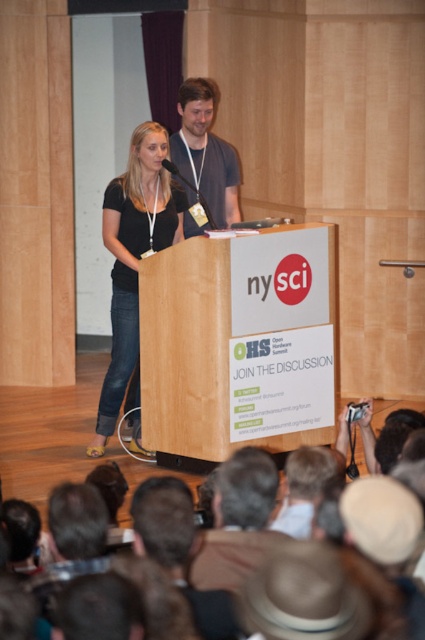
Between point (121, 381) and point (212, 196), which one is positioned behind?

The point (212, 196) is behind.

Based on the photo, can you confirm if matte black shirt at center is positioned to the left of dark gray shirt at center?

Indeed, matte black shirt at center is positioned on the left side of dark gray shirt at center.

Does point (130, 198) come behind point (215, 195)?

No, (130, 198) is in front of (215, 195).

You are a GUI agent. You are given a task and a screenshot of the screen. Output one action in this format:
    pyautogui.click(x=<x>, y=<y>)
    Task: Click on the matte black shirt at center
    
    Given the screenshot: What is the action you would take?
    pyautogui.click(x=133, y=256)

Is dark brown leather jacket at lower center to the left of dark gray shirt at center from the viewer's perspective?

In fact, dark brown leather jacket at lower center is to the right of dark gray shirt at center.

Is dark brown leather jacket at lower center positioned at the back of dark gray shirt at center?

That is False.

The image size is (425, 640). Describe the element at coordinates (238, 522) in the screenshot. I see `dark brown leather jacket at lower center` at that location.

Locate an element on the screen. This screenshot has width=425, height=640. dark brown leather jacket at lower center is located at coordinates (238, 522).

Between brown fabric crowd at lower center and dark gray shirt at center, which one is positioned higher?

dark gray shirt at center is higher up.

Is brown fabric crowd at lower center in front of dark gray shirt at center?

Yes.

The height and width of the screenshot is (640, 425). Identify the location of brown fabric crowd at lower center. (42, 440).

Find the location of `brown fabric crowd at lower center`. brown fabric crowd at lower center is located at coordinates (42, 440).